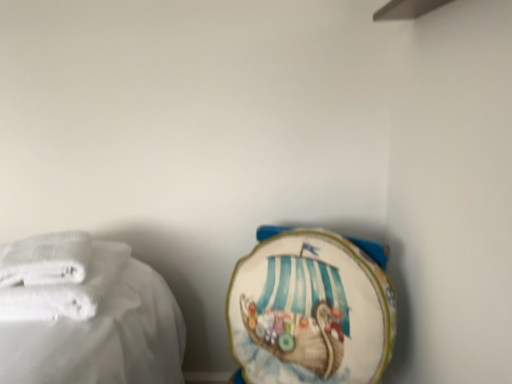
Question: Choose the correct answer: Is white soft towel at left, placed as the 3th towel when sorted from right to left, inside white fabric towel at lower right, which is the 1th towel in right-to-left order, or outside it?

Choices:
 (A) inside
 (B) outside

Answer: (B)

Question: Is white soft towel at left, which is the 1th towel from left to right, wider or thinner than white fabric towel at lower right, which is counted as the 3th towel, starting from the left?

Choices:
 (A) wide
 (B) thin

Answer: (A)

Question: Estimate the real-world distances between objects in this image. Which object is farther from the white soft towel at left, which is the 1th towel from left to right?

Choices:
 (A) white soft towel at left, the 2th towel when ordered from right to left
 (B) white fabric towel at lower right, which is counted as the 3th towel, starting from the left

Answer: (B)

Question: Which is farther from the white soft towel at left, which is the 1th towel from left to right?

Choices:
 (A) white fabric towel at lower right, which is counted as the 3th towel, starting from the left
 (B) white soft towel at left, positioned as the second towel in left-to-right order

Answer: (A)